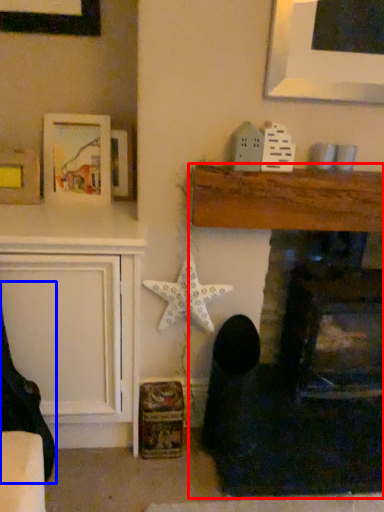
Question: Which object appears closest to the camera in this image, fireplace (highlighted by a red box) or rocking chair (highlighted by a blue box)?

Choices:
 (A) fireplace
 (B) rocking chair

Answer: (B)